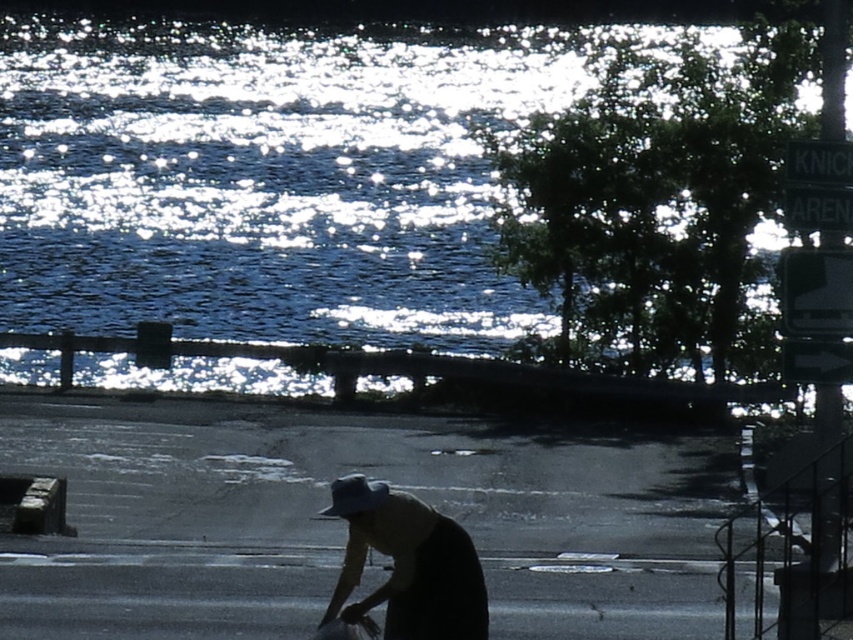
Question: Can you confirm if metallic reflective sign at upper right is positioned to the right of green plastic sign at right?

Choices:
 (A) yes
 (B) no

Answer: (B)

Question: Can you confirm if silhouette fabric hat at lower center is positioned to the right of matte white baseball hat at center?

Choices:
 (A) no
 (B) yes

Answer: (B)

Question: Observing the image, what is the correct spatial positioning of metallic reflective sign at upper right in reference to matte white baseball hat at center?

Choices:
 (A) below
 (B) above

Answer: (B)

Question: Which of these objects is positioned closest to the sparkling blue water at upper center?

Choices:
 (A) matte white baseball hat at center
 (B) white plastic sign at upper right
 (C) black plastic sign at upper right
 (D) metallic reflective sign at upper right

Answer: (C)

Question: Which point is farther to the camera?

Choices:
 (A) (374, 88)
 (B) (376, 520)
 (C) (386, 484)

Answer: (A)

Question: Which of the following is the closest to the observer?

Choices:
 (A) (801, 323)
 (B) (329, 486)
 (C) (412, 524)
 (D) (448, 68)

Answer: (C)